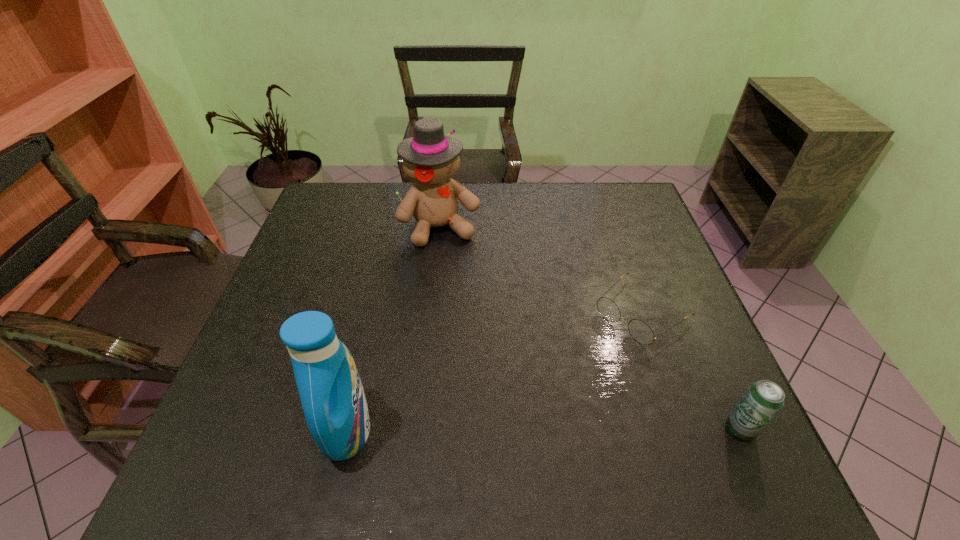
Locate an element on the screen. Image resolution: width=960 pixels, height=540 pixels. free spot on the desktop that is between the detergent and the beer can and is positioned on the temples of the shortest object is located at coordinates (502, 430).

Find the location of a particular element. Image resolution: width=960 pixels, height=540 pixels. free space on the desktop that is between the detergent and the third tallest object and is positioned on the front-facing side of the rag_doll is located at coordinates (529, 430).